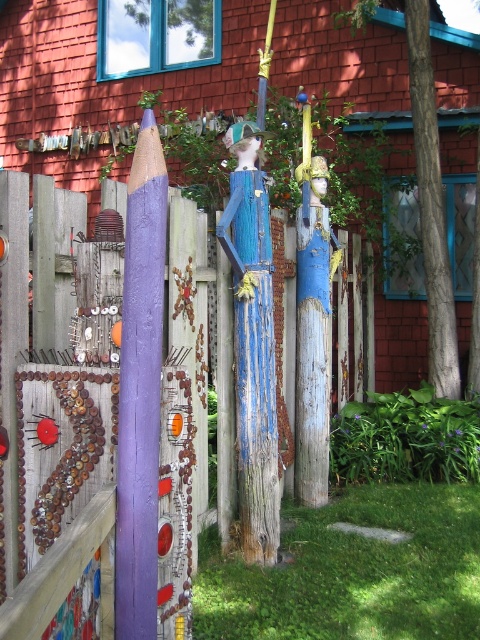
Does wooden fence at center have a lesser width compared to purple painted wood at center?

In fact, wooden fence at center might be wider than purple painted wood at center.

Can you confirm if wooden fence at center is smaller than purple painted wood at center?

Actually, wooden fence at center might be larger than purple painted wood at center.

From the picture: Measure the distance between wooden fence at center and camera.

The distance of wooden fence at center from camera is 1.41 meters.

At what (x,y) coordinates should I click in order to perform the action: click on wooden fence at center. Please return your answer as a coordinate pair (x, y). Looking at the image, I should click on (67, 465).